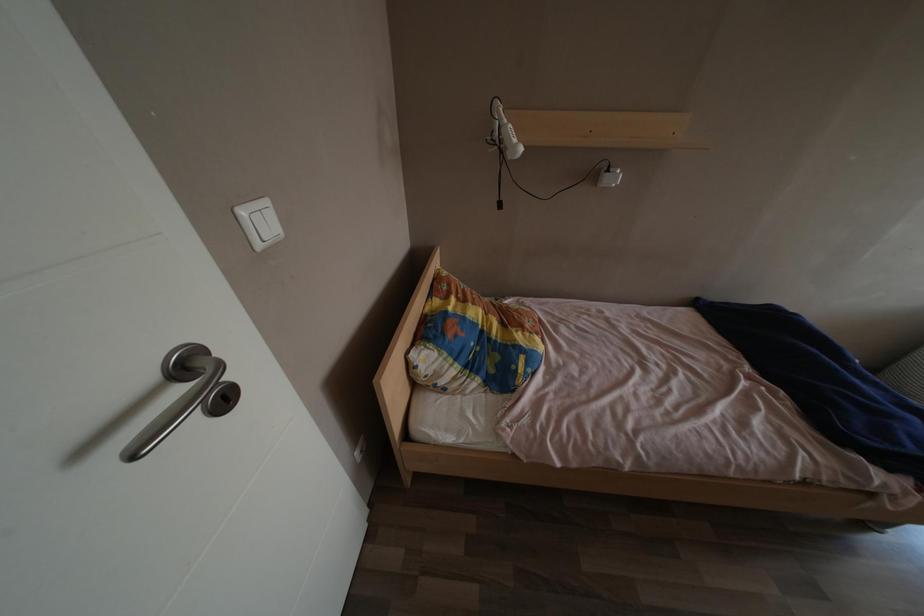
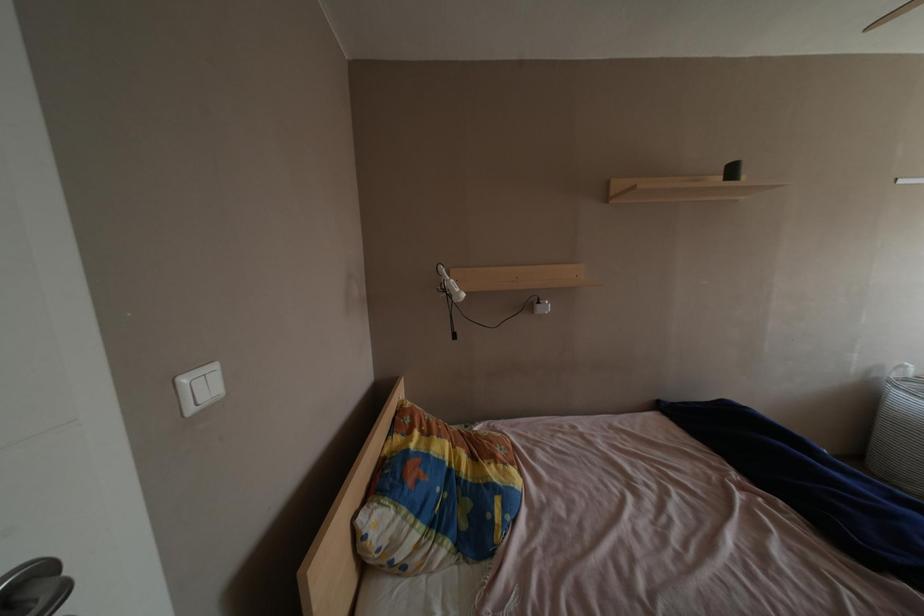
Question: Based on the continuous images, in which direction is the camera rotating? Reply with the corresponding letter.

Choices:
 (A) Left
 (B) Right
 (C) Up
 (D) Down

Answer: (C)